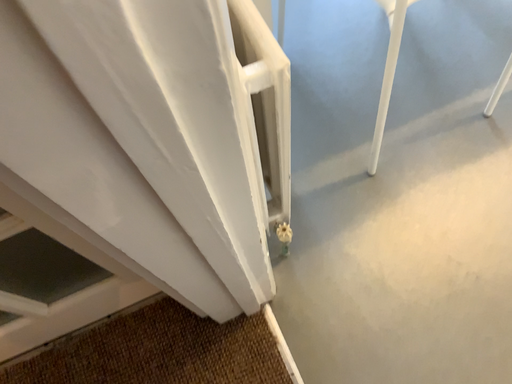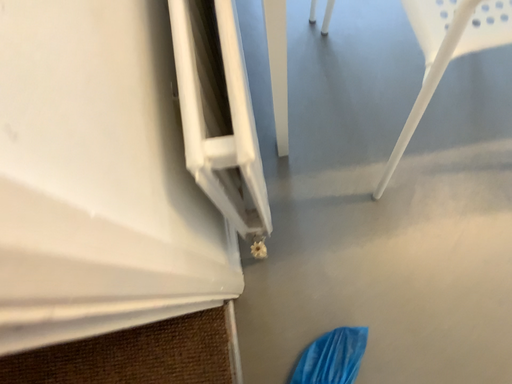
Question: How did the camera likely rotate when shooting the video?

Choices:
 (A) rotated downward
 (B) rotated upward

Answer: (A)